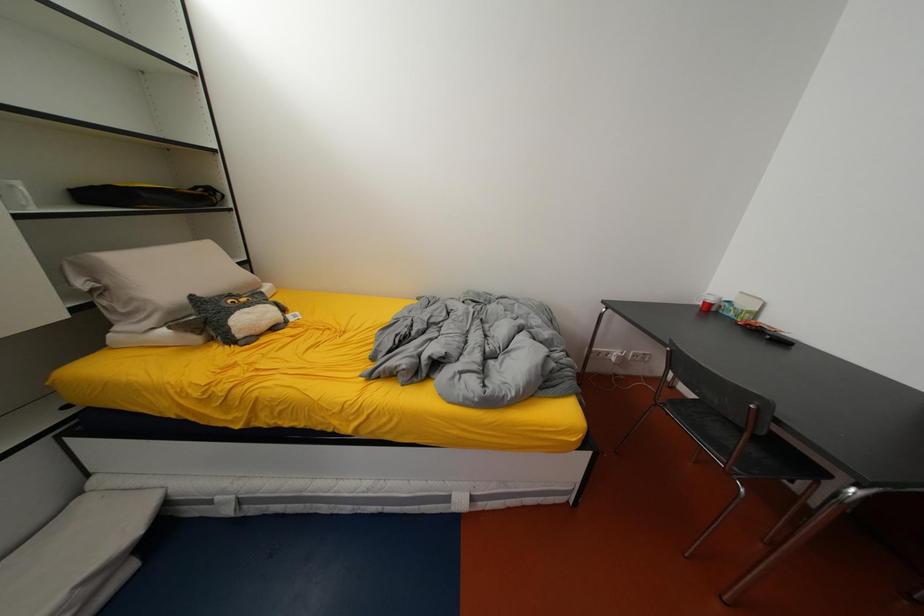
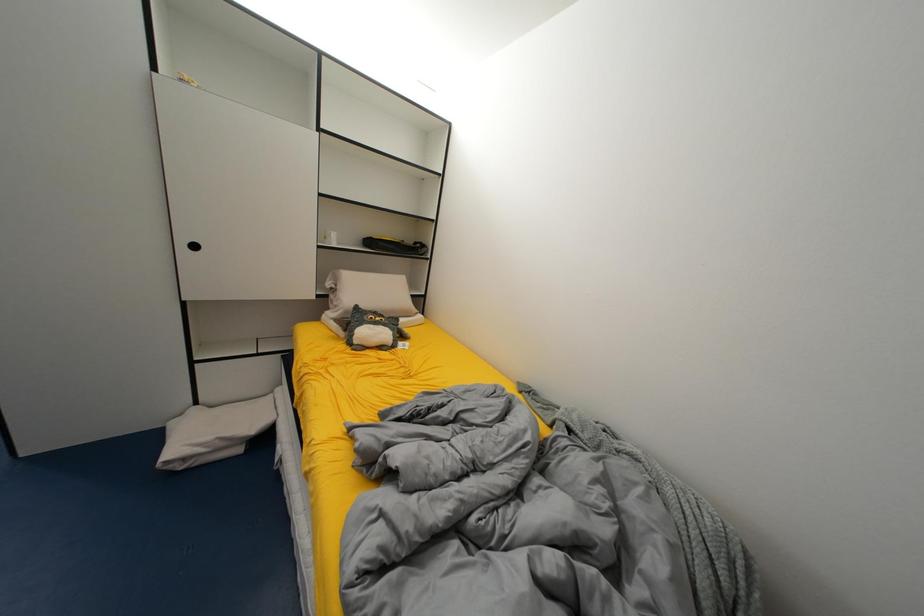
Question: The first image is from the beginning of the video and the second image is from the end. How did the camera likely rotate when shooting the video?

Choices:
 (A) Left
 (B) Right
 (C) Up
 (D) Down

Answer: (A)